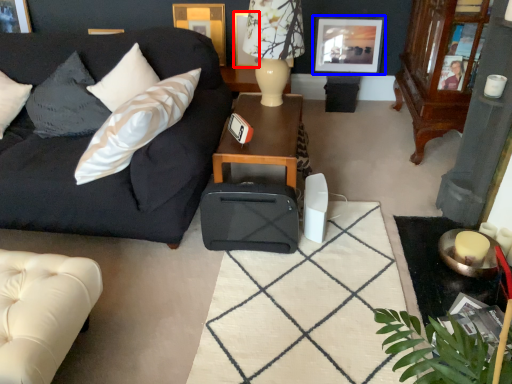
Question: Which of the following is the closest to the observer, picture frame (highlighted by a red box) or picture frame (highlighted by a blue box)?

Choices:
 (A) picture frame
 (B) picture frame

Answer: (B)